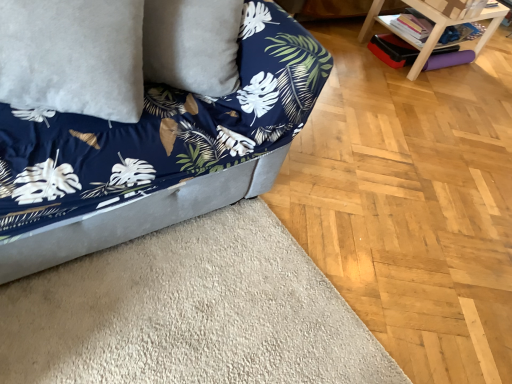
Question: Is white fluffy pillow at upper left wider or thinner than velvet blue couch at lower left?

Choices:
 (A) thin
 (B) wide

Answer: (A)

Question: Is point (118, 23) positioned closer to the camera than point (220, 114)?

Choices:
 (A) farther
 (B) closer

Answer: (B)

Question: Based on their relative distances, which object is farther from the white fluffy pillow at upper left?

Choices:
 (A) velvet blue couch at lower left
 (B) wooden table at upper right

Answer: (B)

Question: Which object is positioned closest to the wooden table at upper right?

Choices:
 (A) velvet blue couch at lower left
 (B) white fluffy pillow at upper left

Answer: (A)